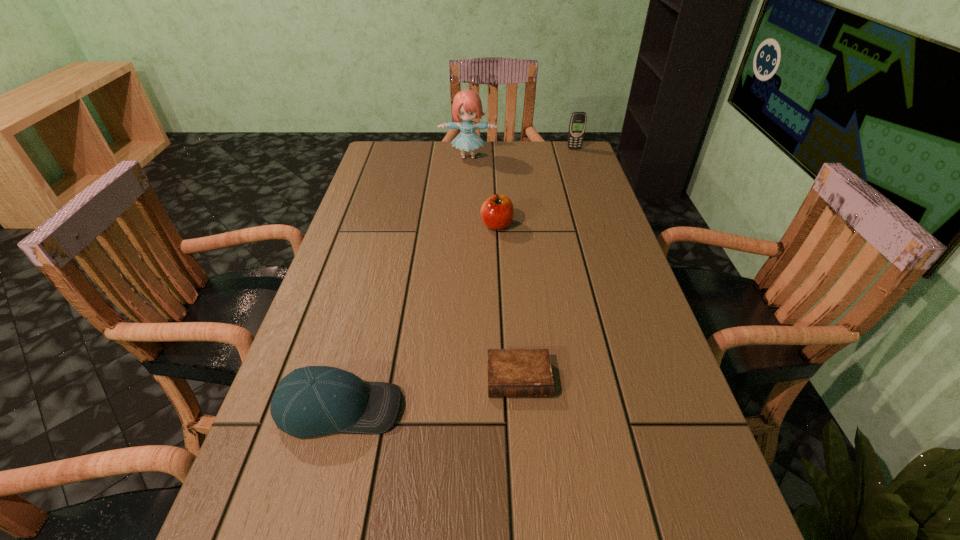
Image resolution: width=960 pixels, height=540 pixels. Identify the location of object identified as the third closest to the baseball cap. (467, 105).

Select which object is the third closest to the baseball cap. Please provide its 2D coordinates. Your answer should be formatted as a tuple, i.e. [(x, y)], where the tuple contains the x and y coordinates of a point satisfying the conditions above.

[(467, 105)]

Identify the location of vacant space that satisfies the following two spatial constraints: 1. on the front-facing side of the third nearest object; 2. on the right side of the doll. (466, 225).